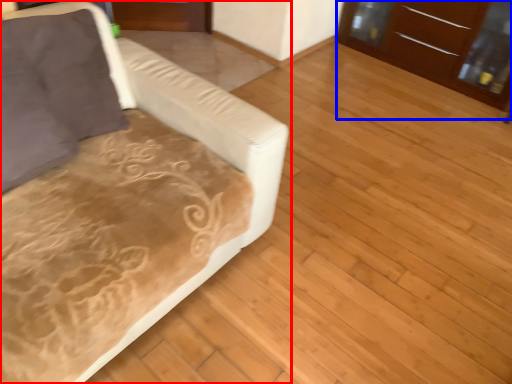
Question: Which point is further to the camera, studio couch (highlighted by a red box) or dresser (highlighted by a blue box)?

Choices:
 (A) studio couch
 (B) dresser

Answer: (B)